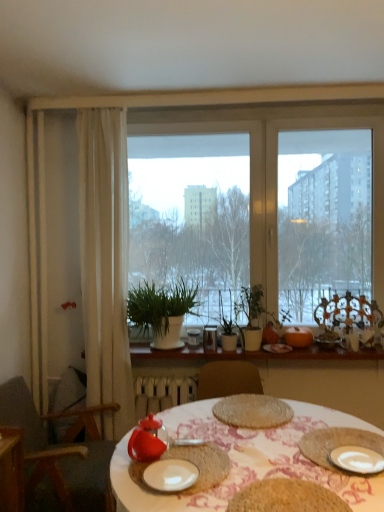
Identify the location of vacant area that lies to the right of transparent glass teapot at lower left, arranged as the first tableware when viewed from the left. (203, 454).